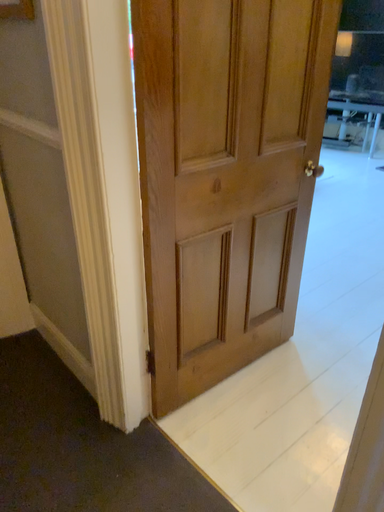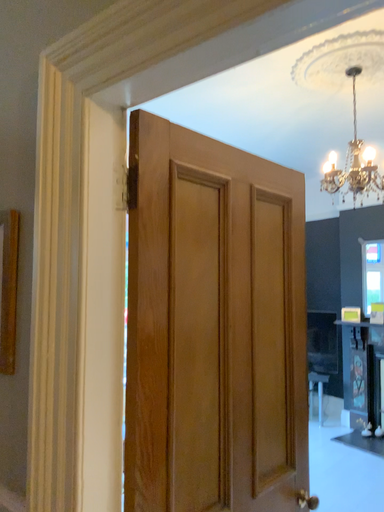
Question: Which way did the camera rotate in the video?

Choices:
 (A) rotated downward
 (B) rotated upward

Answer: (B)